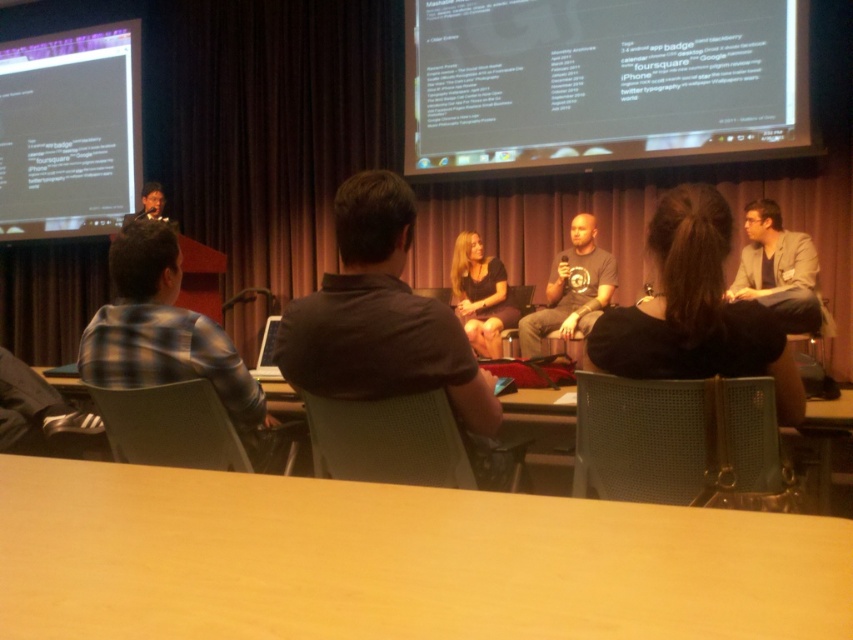
You are an attendee at the conference and you want to take a photo of the plaid shirt at left and the white matte text at upper right. Which one should you focus on first to ensure both are in frame?

You should focus on the plaid shirt at left first because the white matte text at upper right is positioned to the right of it, so adjusting the camera to include both would require framing from the left object outward.

You are an event coordinator planning to place a 1.2 meter tall decorative plant between the matte gray blazer at right and the dark matte dress at center. Based on their heights, will the plant be taller than both?

The matte gray blazer at right is not as tall as the dark matte dress at center. Since the plant is 1.2 meters tall, we need to compare it to the taller object, which is the dark matte dress at center. However, without knowing the exact height of the dress, we cannot definitively determine if the plant will be taller than both. Additional information about the dress height is required.